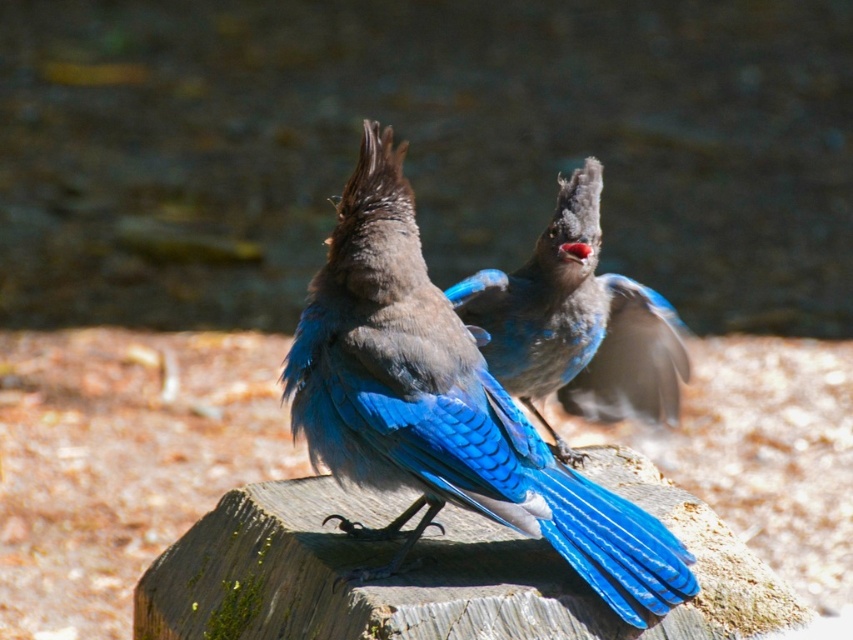
Who is positioned more to the right, shiny blue feathers at center or blue glossy feathers at center?

From the viewer's perspective, blue glossy feathers at center appears more on the right side.

Who is taller, shiny blue feathers at center or blue glossy feathers at center?

shiny blue feathers at center is taller.

The image size is (853, 640). In order to click on shiny blue feathers at center in this screenshot , I will do `click(445, 406)`.

Image resolution: width=853 pixels, height=640 pixels. In order to click on shiny blue feathers at center in this screenshot , I will do `click(445, 406)`.